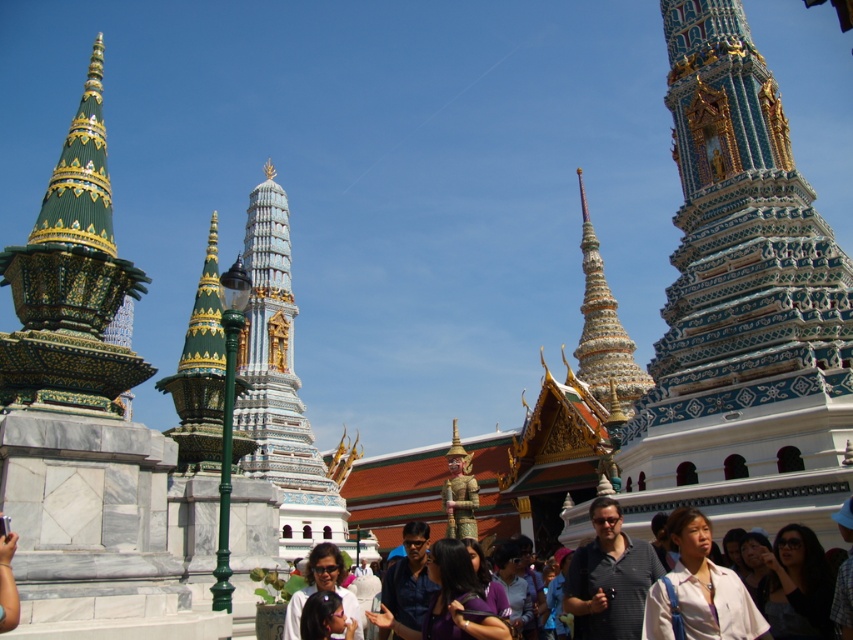
Between dark blue shirt at lower right and dark blue shirt at center, which one has more height?

With more height is dark blue shirt at center.

Is point (769, 550) positioned in front of point (424, 637)?

No, (769, 550) is behind (424, 637).

Locate an element on the screen. Image resolution: width=853 pixels, height=640 pixels. dark blue shirt at lower right is located at coordinates (796, 586).

What are the coordinates of `dark blue shirt at lower right` in the screenshot? It's located at (796, 586).

Does dark gray striped shirt at center have a greater height compared to dark blue shirt at center?

Indeed, dark gray striped shirt at center has a greater height compared to dark blue shirt at center.

What do you see at coordinates (608, 577) in the screenshot? I see `dark gray striped shirt at center` at bounding box center [608, 577].

The width and height of the screenshot is (853, 640). What do you see at coordinates (608, 577) in the screenshot?
I see `dark gray striped shirt at center` at bounding box center [608, 577].

At what (x,y) coordinates should I click in order to perform the action: click on dark gray striped shirt at center. Please return your answer as a coordinate pair (x, y). Looking at the image, I should click on (608, 577).

Can you confirm if green mosaic stupa at left is positioned below white matte shirt at lower center?

Incorrect, green mosaic stupa at left is not positioned below white matte shirt at lower center.

Which of these two, green mosaic stupa at left or white matte shirt at lower center, stands shorter?

With less height is white matte shirt at lower center.

Is point (13, 356) closer to viewer compared to point (744, 632)?

No.

The height and width of the screenshot is (640, 853). I want to click on green mosaic stupa at left, so click(71, 280).